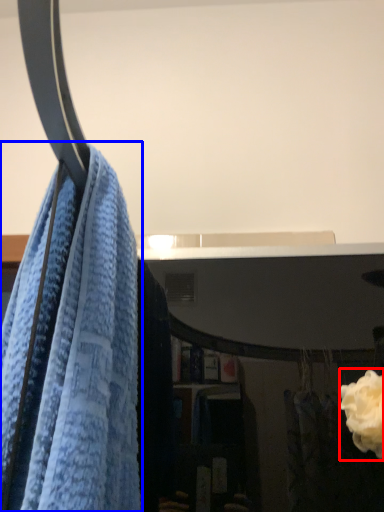
Question: Which object is further to the camera taking this photo, rose (highlighted by a red box) or towel (highlighted by a blue box)?

Choices:
 (A) rose
 (B) towel

Answer: (A)